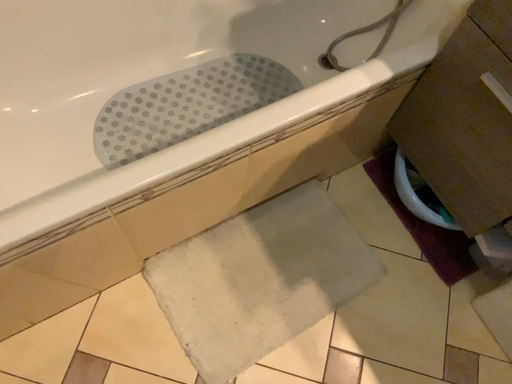
Where is `free location above white soft bath mat at lower center, positioned as the 2th bath mat in right-to-left order (from a real-world perspective)`? This screenshot has width=512, height=384. free location above white soft bath mat at lower center, positioned as the 2th bath mat in right-to-left order (from a real-world perspective) is located at coordinates (270, 273).